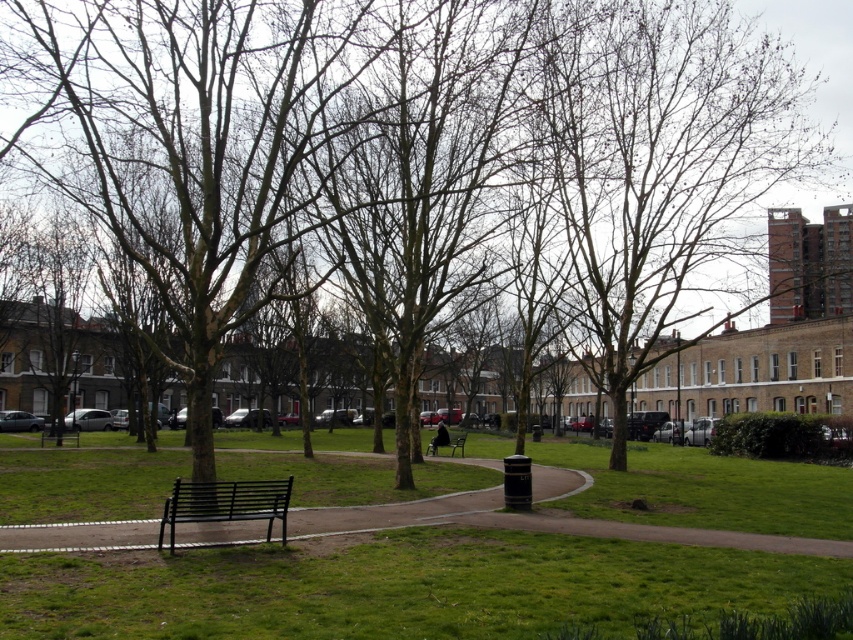
Based on the photo, you are planning to walk through the park and want to know which area is wider between the green grass at center and the smooth concrete path at center. Which one is wider?

The green grass at center is wider than the smooth concrete path at center.

You are a landscape architect designing a new park. You need to place a 5 meter wide flower bed between the green grass at center and the smooth concrete path at center. Is this feasible given their current spacing?

The green grass at center and smooth concrete path at center are 4.76 meters apart. Since the flower bed requires 5 meters of space, it is not feasible to place it between them as the available space is slightly less than required.

You are standing at the entrance of the park and want to find the black metal bench at center. Looking at the green grass at center, where should you look relative to it to locate the bench?

The black metal bench at center is to the right of the green grass at center.